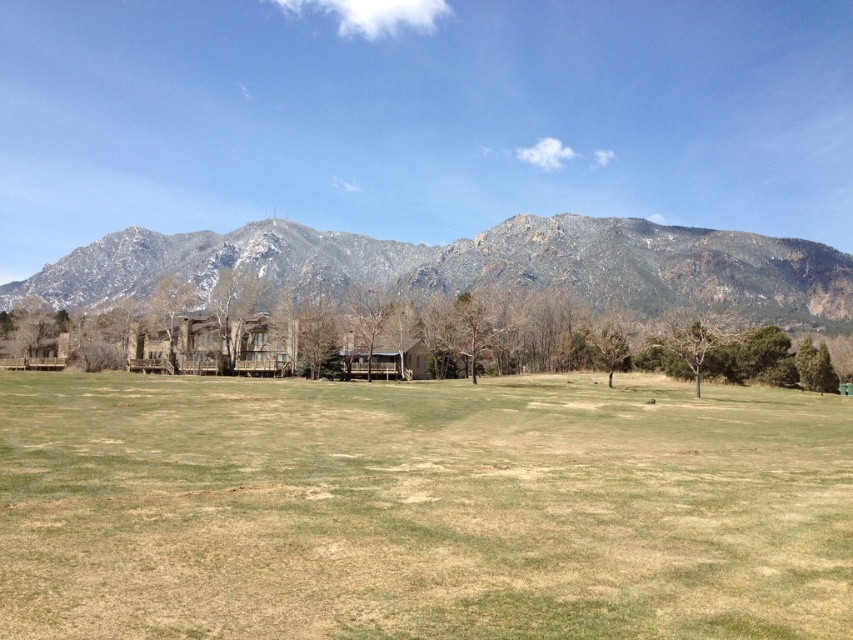
You are standing in the middle of the green grassy field at center and want to walk towards the brown textured tree at center. Which direction should you head?

Since the green grassy field at center is closer to the viewer than the brown textured tree at center, you should head towards the center of the image to reach the brown textured tree at center.

You are planning to build a hiking trail that starts at the wooden cabin at center and goes towards the rocky gray mountain range at upper center. Based on the scene, will the trail be visible from the cabin once it is built?

The wooden cabin at center is behind the rocky gray mountain range at upper center, so the trail would be obscured by the mountain range from the cabin view. Therefore, the trail will not be visible from the cabin.

You are planning to set up a tent in the green grassy field at center. Considering the presence of the brown textured tree at center, how does the height of the field compare to the tree?

The green grassy field at center has a lesser height compared to the brown textured tree at center, so the tree is taller than the field.